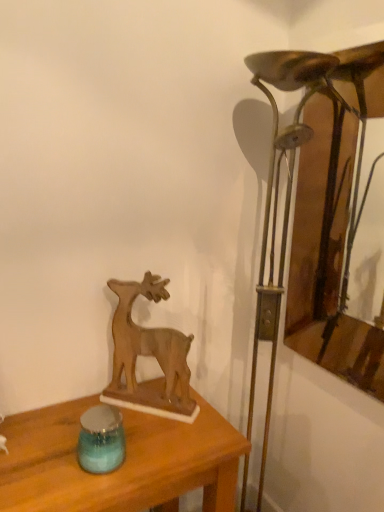
Identify the location of free space above wooden table at center (from a real-world perspective). (123, 457).